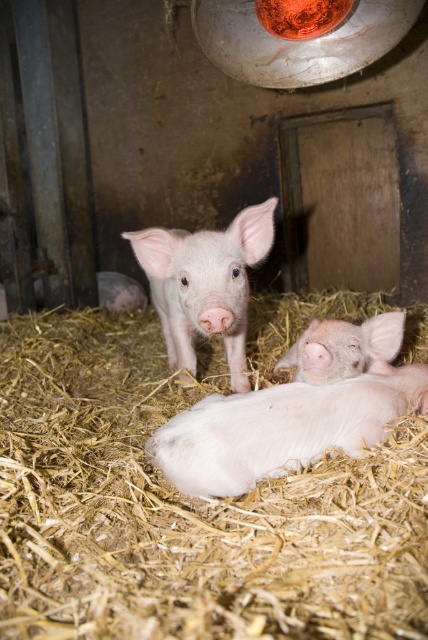
Is light brown straw at center above white soft pig at lower center?

Correct, light brown straw at center is located above white soft pig at lower center.

Does light brown straw at center have a larger size compared to white soft pig at lower center?

Yes.

Who is more forward, (419, 518) or (368, 387)?

Point (419, 518) is in front.

I want to click on light brown straw at center, so click(184, 508).

Does white soft pig at lower center have a greater width compared to pink smooth piglet at center?

Yes.

Looking at this image, is white soft pig at lower center below pink smooth piglet at center?

Yes, white soft pig at lower center is below pink smooth piglet at center.

Locate an element on the screen. white soft pig at lower center is located at coordinates (281, 428).

At what (x,y) coordinates should I click in order to perform the action: click on white soft pig at lower center. Please return your answer as a coordinate pair (x, y). The height and width of the screenshot is (640, 428). Looking at the image, I should click on point(281,428).

Who is higher up, white soft pig at lower center or pink soft fur piglet at center?

Positioned higher is pink soft fur piglet at center.

What do you see at coordinates (281, 428) in the screenshot? The image size is (428, 640). I see `white soft pig at lower center` at bounding box center [281, 428].

Find the location of a particular element. Image resolution: width=428 pixels, height=640 pixels. white soft pig at lower center is located at coordinates (281, 428).